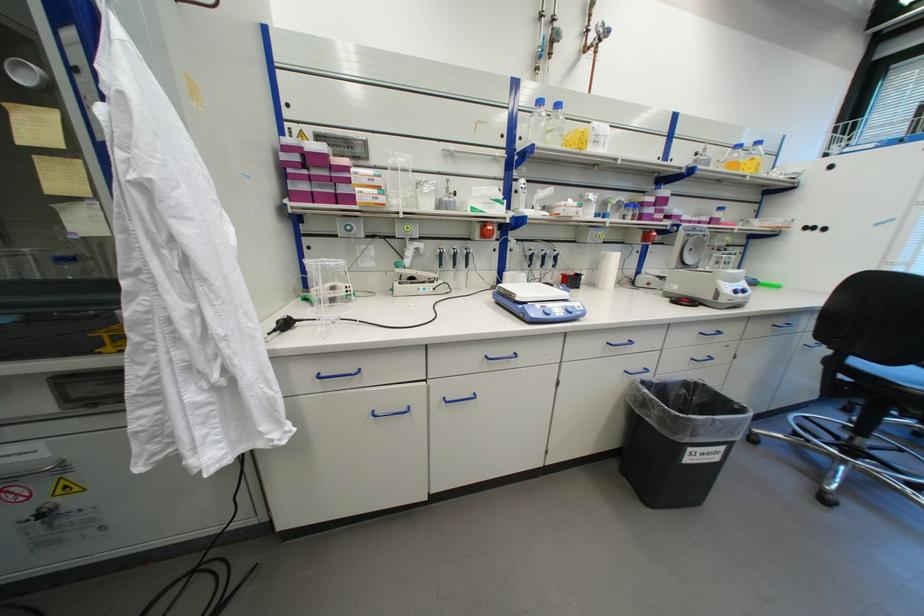
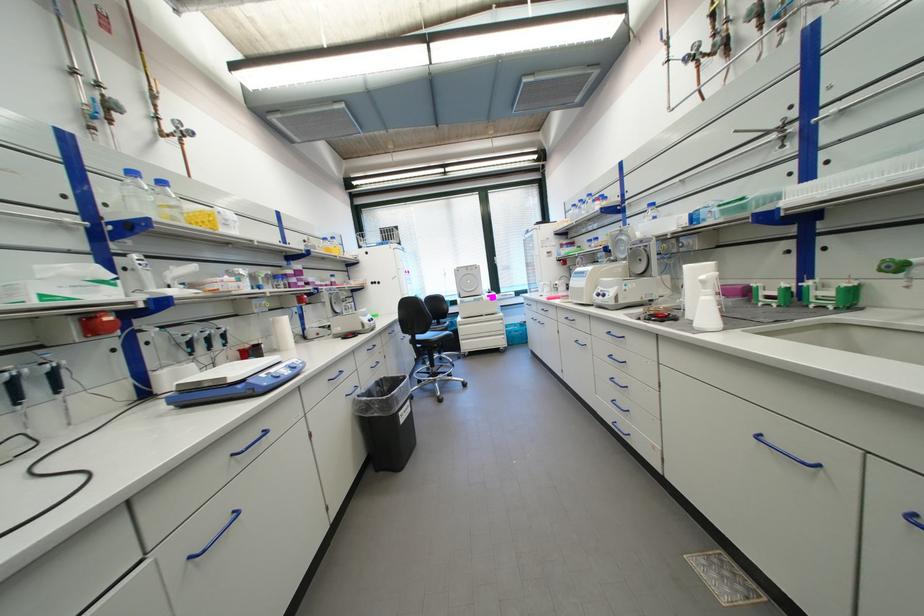
Find the pixel in the second image that matches point (556, 105) in the first image.

(156, 180)